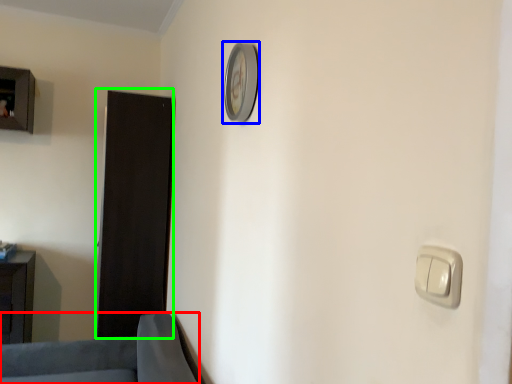
Question: Which is nearer to the furniture (highlighted by a red box)? clock (highlighted by a blue box) or door (highlighted by a green box).

Choices:
 (A) clock
 (B) door

Answer: (B)